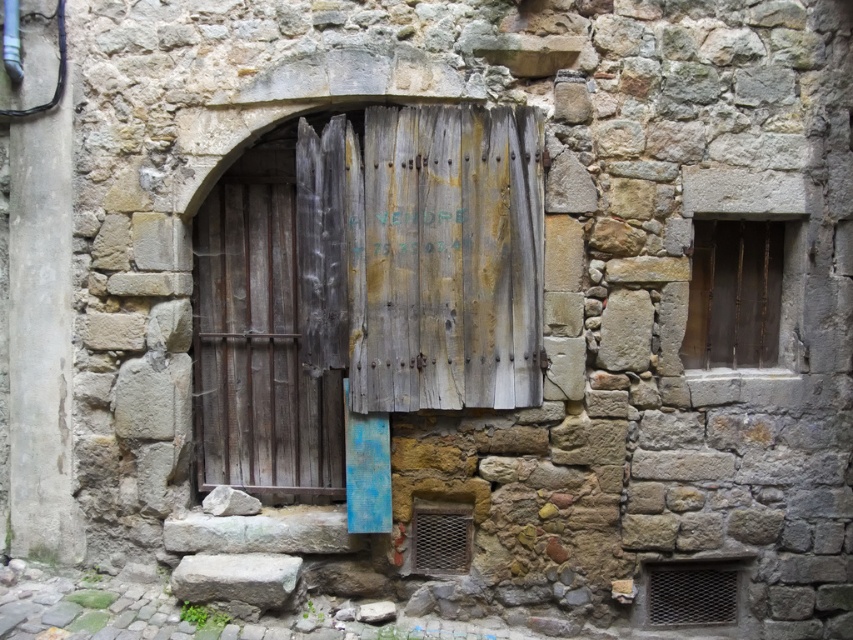
You are standing in front of the aged stone wall with the rustic wooden door. There are two points marked on the wall. The first point is at coordinate point[415,336] and the second is at point[706,250]. If you want to touch both points starting from the nearest one, which point should you touch first?

You should touch point[415,336] first because it is closer to you than point[706,250].

You are standing in front of the aged stone wall and the rustic wooden door. There are two points marked on the wall at coordinates point [712,284] and point [724,564]. Which of these points is nearer to your current position?

Point [712,284] is closer to the camera than point [724,564], so the point at [712,284] is nearer to your current position.